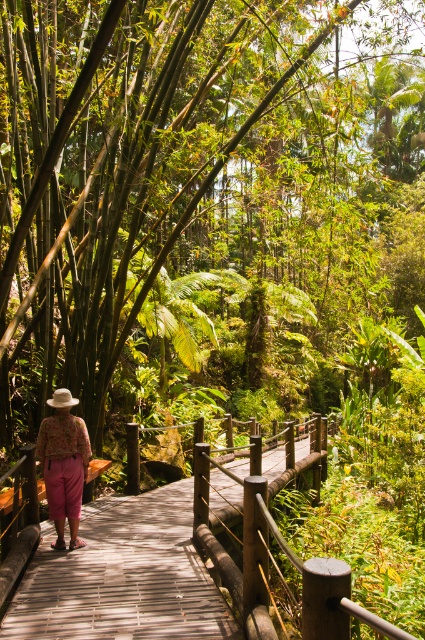
Question: Is wooden bridge at center bigger than floral fabric pants at center?

Choices:
 (A) yes
 (B) no

Answer: (B)

Question: Can you confirm if wooden bridge at center is positioned below floral fabric pants at center?

Choices:
 (A) yes
 (B) no

Answer: (A)

Question: Which object is farther from the camera taking this photo?

Choices:
 (A) floral fabric pants at center
 (B) wooden bridge at center

Answer: (B)

Question: Considering the relative positions of wooden bridge at center and floral fabric pants at center in the image provided, where is wooden bridge at center located with respect to floral fabric pants at center?

Choices:
 (A) above
 (B) below

Answer: (B)

Question: Among these objects, which one is farthest from the camera?

Choices:
 (A) floral fabric pants at center
 (B) wooden bridge at center

Answer: (B)